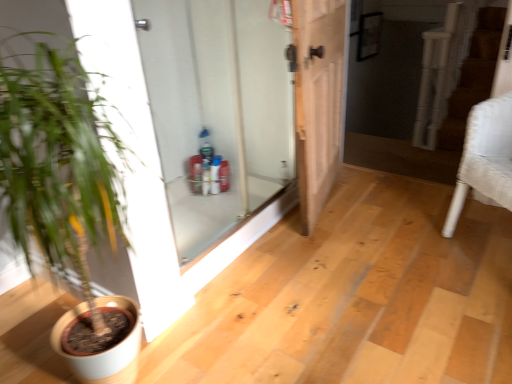
This screenshot has height=384, width=512. Describe the element at coordinates (217, 109) in the screenshot. I see `white glass door at center, acting as the first door starting from the left` at that location.

Find the location of `white matte pot at left`. white matte pot at left is located at coordinates (64, 188).

What do you see at coordinates (485, 158) in the screenshot? The width and height of the screenshot is (512, 384). I see `white textured armchair at right` at bounding box center [485, 158].

Find the location of a particular element. The image size is (512, 384). white glass door at center, acting as the first door starting from the left is located at coordinates (217, 109).

In the scene shown: How far apart are light brown wooden door at center, which appears as the 1th door when viewed from the right, and white glass door at center, the second door viewed from the right?

light brown wooden door at center, which appears as the 1th door when viewed from the right, is 15.51 inches from white glass door at center, the second door viewed from the right.

Is point (304, 208) positioned behind point (206, 32)?

No, it is not.

From the picture: From the image's perspective, is light brown wooden door at center, arranged as the 2th door when viewed from the left, beneath white glass door at center, the second door viewed from the right?

No, from the image's perspective, light brown wooden door at center, arranged as the 2th door when viewed from the left, is not below white glass door at center, the second door viewed from the right.

Does light brown wooden door at center, arranged as the 2th door when viewed from the left, contain white glass door at center, the second door viewed from the right?

Definitely not — white glass door at center, the second door viewed from the right, is not inside light brown wooden door at center, arranged as the 2th door when viewed from the left.

From the image's perspective, which object appears higher, white glass door at center, the second door viewed from the right, or light brown wooden door at center, which appears as the 1th door when viewed from the right?

light brown wooden door at center, which appears as the 1th door when viewed from the right, appears higher in the image.

Is white glass door at center, acting as the first door starting from the left, not close to light brown wooden door at center, arranged as the 2th door when viewed from the left?

No, there isn't a large distance between white glass door at center, acting as the first door starting from the left, and light brown wooden door at center, arranged as the 2th door when viewed from the left.

Which is more to the right, white glass door at center, the second door viewed from the right, or light brown wooden door at center, arranged as the 2th door when viewed from the left?

light brown wooden door at center, arranged as the 2th door when viewed from the left.

Does point (219, 205) come closer to viewer compared to point (324, 181)?

No, (219, 205) is further to viewer.

Is white glass door at center, the second door viewed from the right, located outside white matte pot at left?

Absolutely, white glass door at center, the second door viewed from the right, is external to white matte pot at left.

Which object is closer to the camera taking this photo, white glass door at center, the second door viewed from the right, or white matte pot at left?

white matte pot at left.

From the image's perspective, is white glass door at center, acting as the first door starting from the left, positioned above or below white matte pot at left?

From the image's perspective, white glass door at center, acting as the first door starting from the left, appears above white matte pot at left.

Are white glass door at center, the second door viewed from the right, and white matte pot at left making contact?

No.

Is light brown wooden door at center, which appears as the 1th door when viewed from the right, inside white textured armchair at right?

No, light brown wooden door at center, which appears as the 1th door when viewed from the right, is not surrounded by white textured armchair at right.

From a real-world perspective, is white textured armchair at right physically located above or below light brown wooden door at center, which appears as the 1th door when viewed from the right?

In terms of real-world spatial position, white textured armchair at right is below light brown wooden door at center, which appears as the 1th door when viewed from the right.

Is white textured armchair at right far from light brown wooden door at center, arranged as the 2th door when viewed from the left?

No, white textured armchair at right is in close proximity to light brown wooden door at center, arranged as the 2th door when viewed from the left.

From a real-world perspective, is white matte pot at left positioned above or below white glass door at center, acting as the first door starting from the left?

In terms of real-world spatial position, white matte pot at left is below white glass door at center, acting as the first door starting from the left.

Which is correct: white matte pot at left is inside white glass door at center, the second door viewed from the right, or outside of it?

white matte pot at left is not inside white glass door at center, the second door viewed from the right, it's outside.

Is point (36, 74) closer or farther from the camera than point (226, 25)?

Point (36, 74).

Is white matte pot at left situated inside white textured armchair at right or outside?

white matte pot at left is located beyond the bounds of white textured armchair at right.

Based on their positions, is white matte pot at left located to the left or right of white textured armchair at right?

white matte pot at left is to the left of white textured armchair at right.

Based on the photo, considering the sizes of white matte pot at left and white textured armchair at right in the image, is white matte pot at left wider or thinner than white textured armchair at right?

white matte pot at left is wider than white textured armchair at right.

Who is shorter, light brown wooden door at center, arranged as the 2th door when viewed from the left, or white matte pot at left?

With less height is light brown wooden door at center, arranged as the 2th door when viewed from the left.

Considering the sizes of light brown wooden door at center, which appears as the 1th door when viewed from the right, and white matte pot at left in the image, is light brown wooden door at center, which appears as the 1th door when viewed from the right, wider or thinner than white matte pot at left?

Clearly, light brown wooden door at center, which appears as the 1th door when viewed from the right, has less width compared to white matte pot at left.

How different are the orientations of light brown wooden door at center, which appears as the 1th door when viewed from the right, and white matte pot at left in degrees?

The angular difference between light brown wooden door at center, which appears as the 1th door when viewed from the right, and white matte pot at left is 11.4 degrees.

Which is correct: light brown wooden door at center, which appears as the 1th door when viewed from the right, is inside white matte pot at left, or outside of it?

light brown wooden door at center, which appears as the 1th door when viewed from the right, lies outside white matte pot at left.

Where is `door in front of the light brown wooden door at center, arranged as the 2th door when viewed from the left`? This screenshot has height=384, width=512. door in front of the light brown wooden door at center, arranged as the 2th door when viewed from the left is located at coordinates (217, 109).

You are a GUI agent. You are given a task and a screenshot of the screen. Output one action in this format:
    pyautogui.click(x=<x>, y=<y>)
    Task: Click on the door above the light brown wooden door at center, arranged as the 2th door when viewed from the left (from a real-world perspective)
    Image resolution: width=512 pixels, height=384 pixels.
    Given the screenshot: What is the action you would take?
    pos(217,109)

Estimate the real-world distances between objects in this image. Which object is further from white glass door at center, the second door viewed from the right, light brown wooden door at center, which appears as the 1th door when viewed from the right, or white matte pot at left?

white matte pot at left is positioned further to the anchor white glass door at center, the second door viewed from the right.

Consider the image. When comparing their distances from white matte pot at left, does white textured armchair at right or white glass door at center, acting as the first door starting from the left, seem closer?

white glass door at center, acting as the first door starting from the left.

Looking at the image, which one is located further to white textured armchair at right, white glass door at center, the second door viewed from the right, or white matte pot at left?

white matte pot at left lies further to white textured armchair at right than the other object.

When comparing their distances from white textured armchair at right, does white matte pot at left or white glass door at center, acting as the first door starting from the left, seem further?

Among the two, white matte pot at left is located further to white textured armchair at right.

Looking at the image, which one is located closer to light brown wooden door at center, which appears as the 1th door when viewed from the right, white glass door at center, acting as the first door starting from the left, or white textured armchair at right?

white glass door at center, acting as the first door starting from the left, lies closer to light brown wooden door at center, which appears as the 1th door when viewed from the right, than the other object.

Estimate the real-world distances between objects in this image. Which object is closer to white glass door at center, the second door viewed from the right, light brown wooden door at center, arranged as the 2th door when viewed from the left, or white textured armchair at right?

light brown wooden door at center, arranged as the 2th door when viewed from the left, is positioned closer to the anchor white glass door at center, the second door viewed from the right.

Considering their positions, is white textured armchair at right positioned closer to white glass door at center, acting as the first door starting from the left, than white matte pot at left?

white matte pot at left.

When comparing their distances from light brown wooden door at center, which appears as the 1th door when viewed from the right, does white textured armchair at right or white matte pot at left seem closer?

Based on the image, white textured armchair at right appears to be nearer to light brown wooden door at center, which appears as the 1th door when viewed from the right.

This screenshot has height=384, width=512. What are the coordinates of `door between white matte pot at left and light brown wooden door at center, arranged as the 2th door when viewed from the left, along the z-axis` in the screenshot? It's located at (217, 109).

This screenshot has height=384, width=512. Identify the location of door between white glass door at center, acting as the first door starting from the left, and white textured armchair at right from left to right. (318, 99).